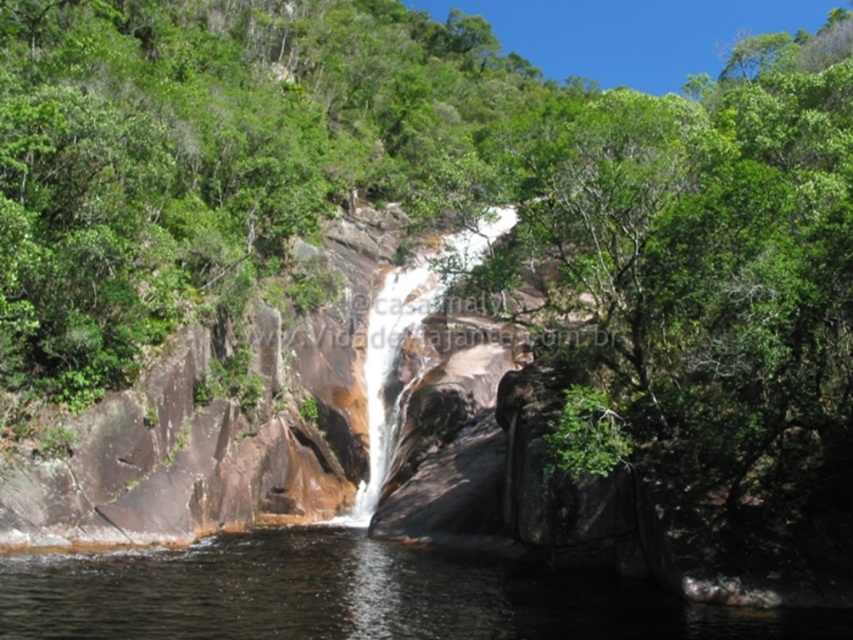
Question: Can you confirm if clear water at center is positioned to the left of white smooth waterfall at center?

Choices:
 (A) no
 (B) yes

Answer: (B)

Question: Which object appears closest to the camera in this image?

Choices:
 (A) white smooth waterfall at center
 (B) clear water at center

Answer: (B)

Question: Among these objects, which one is farthest from the camera?

Choices:
 (A) clear water at center
 (B) white smooth waterfall at center

Answer: (B)

Question: Which object appears farthest from the camera in this image?

Choices:
 (A) white smooth waterfall at center
 (B) clear water at center

Answer: (A)

Question: Is clear water at center smaller than white smooth waterfall at center?

Choices:
 (A) yes
 (B) no

Answer: (A)

Question: Is clear water at center further to camera compared to white smooth waterfall at center?

Choices:
 (A) no
 (B) yes

Answer: (A)